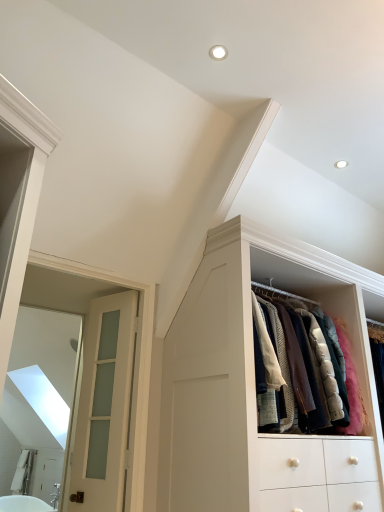
This screenshot has width=384, height=512. I want to click on white glossy bathtub at lower left, so click(23, 504).

Where is `white frosted glass door at left`? Image resolution: width=384 pixels, height=512 pixels. white frosted glass door at left is located at coordinates (104, 405).

Find the location of a particular element. This screenshot has width=384, height=512. white glossy bathtub at lower left is located at coordinates (23, 504).

In the scene shown: From the image's perspective, which is above, white glossy bathtub at lower left or white frosted glass door at left?

white frosted glass door at left, from the image's perspective.

Is white glossy bathtub at lower left placed right next to white frosted glass door at left?

No.

Locate an element on the screen. Image resolution: width=384 pixels, height=512 pixels. door that appears above the white glossy bathtub at lower left (from a real-world perspective) is located at coordinates (104, 405).

Considering the positions of point (4, 496) and point (104, 422), is point (4, 496) closer or farther from the camera than point (104, 422)?

Point (4, 496) is positioned farther from the camera compared to point (104, 422).

Is white glossy bathtub at lower left oriented away from white wood cabinet at upper right?

white glossy bathtub at lower left does not have its back to white wood cabinet at upper right.

Which object is thinner, white glossy bathtub at lower left or white wood cabinet at upper right?

With smaller width is white wood cabinet at upper right.

Is white glossy bathtub at lower left not close to white wood cabinet at upper right?

Absolutely, white glossy bathtub at lower left is distant from white wood cabinet at upper right.

From a real-world perspective, is white glossy bathtub at lower left physically located above or below white wood cabinet at upper right?

Clearly, from a real-world perspective, white glossy bathtub at lower left is below white wood cabinet at upper right.

Between white wood cabinet at upper right and white frosted glass door at left, which one appears on the right side from the viewer's perspective?

white wood cabinet at upper right.

From the image's perspective, would you say white wood cabinet at upper right is shown under white frosted glass door at left?

Incorrect, from the image's perspective, white wood cabinet at upper right is higher than white frosted glass door at left.

Looking at this image, from a real-world perspective, is white wood cabinet at upper right physically located above or below white frosted glass door at left?

white wood cabinet at upper right is above white frosted glass door at left.

Is white wood cabinet at upper right positioned in front of white frosted glass door at left?

Yes, the depth of white wood cabinet at upper right is less than that of white frosted glass door at left.

Who is shorter, white frosted glass door at left or white wood cabinet at upper right?

Standing shorter between the two is white wood cabinet at upper right.

Which point is more forward, [125,462] or [213,442]?

The point [213,442] is in front.

From a real-world perspective, between white frosted glass door at left and white wood cabinet at upper right, who is vertically higher?

white wood cabinet at upper right, from a real-world perspective.

Where is `door below the white wood cabinet at upper right (from the image's perspective)`? door below the white wood cabinet at upper right (from the image's perspective) is located at coordinates (104, 405).

Who is smaller, white frosted glass door at left or white glossy bathtub at lower left?

white frosted glass door at left is smaller.

Considering the positions of objects white frosted glass door at left and white glossy bathtub at lower left in the image provided, who is more to the left, white frosted glass door at left or white glossy bathtub at lower left?

white glossy bathtub at lower left.

Is point (118, 328) positioned in front of point (9, 503)?

That is False.

Is white frosted glass door at left next to white glossy bathtub at lower left?

No, white frosted glass door at left is not making contact with white glossy bathtub at lower left.

Looking at this image, is white wood cabinet at upper right thinner than white glossy bathtub at lower left?

Indeed, white wood cabinet at upper right has a lesser width compared to white glossy bathtub at lower left.

Do you think white wood cabinet at upper right is within white glossy bathtub at lower left, or outside of it?

white wood cabinet at upper right is located beyond the bounds of white glossy bathtub at lower left.

Which is closer to the camera, (240, 340) or (51, 507)?

The point (240, 340) is more forward.

Can you confirm if white wood cabinet at upper right is smaller than white glossy bathtub at lower left?

No.

The image size is (384, 512). Find the location of `bath behind the white frosted glass door at left`. bath behind the white frosted glass door at left is located at coordinates (23, 504).

Locate an element on the screen. cabinetry that appears above the white glossy bathtub at lower left (from a real-world perspective) is located at coordinates (256, 386).

Estimate the real-world distances between objects in this image. Which object is closer to white wood cabinet at upper right, white frosted glass door at left or white glossy bathtub at lower left?

white frosted glass door at left is positioned closer to the anchor white wood cabinet at upper right.

Consider the image. Estimate the real-world distances between objects in this image. Which object is further from white glossy bathtub at lower left, white frosted glass door at left or white wood cabinet at upper right?

The object further to white glossy bathtub at lower left is white wood cabinet at upper right.

Which object lies further to the anchor point white frosted glass door at left, white glossy bathtub at lower left or white wood cabinet at upper right?

white glossy bathtub at lower left is positioned further to the anchor white frosted glass door at left.

When comparing their distances from white frosted glass door at left, does white wood cabinet at upper right or white glossy bathtub at lower left seem closer?

Among the two, white wood cabinet at upper right is located nearer to white frosted glass door at left.

Estimate the real-world distances between objects in this image. Which object is further from white wood cabinet at upper right, white glossy bathtub at lower left or white frosted glass door at left?

white glossy bathtub at lower left is further to white wood cabinet at upper right.

Looking at the image, which one is located closer to white glossy bathtub at lower left, white wood cabinet at upper right or white frosted glass door at left?

Based on the image, white frosted glass door at left appears to be nearer to white glossy bathtub at lower left.

This screenshot has height=512, width=384. I want to click on door between white wood cabinet at upper right and white glossy bathtub at lower left in the vertical direction, so click(x=104, y=405).